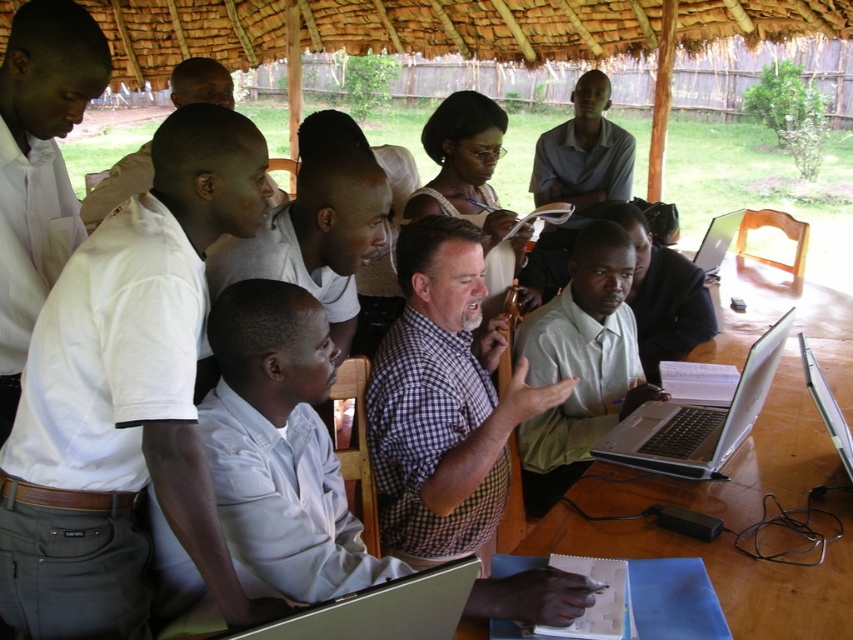
You are a photographer positioned to the right of the scene. You want to capture a photo that includes both the white cotton shirt at left and the silver metallic laptop at lower right. Which object should you adjust your position to focus on first to ensure both are in frame?

The white cotton shirt at left is to the left of the silver metallic laptop at lower right. To include both in the frame, you should first focus on the white cotton shirt at left since it is positioned further to the left, ensuring that adjusting towards the right will still keep the silver metallic laptop at lower right within the shot.

You are a person who is 1.7 meters tall and standing at the viewer position. You want to reach a laptop placed at point (838, 422). Can you comfortably reach it without stretching too much?

The distance between you and the laptop at point (838, 422) is 1.62 meters. Since the average comfortable reaching distance for an adult is about 0.5 to 1 meter, you would need to stretch significantly to reach it.

You are a photographer standing at the camera position. You want to take a photo that includes both point (850, 444) and point (741, 211). Which point should you focus on first to ensure both are in sharp focus?

You should focus on point (741, 211) first because it is farther from the camera than point (850, 444). By focusing on the farther point, the near point will also be within the depth of field.